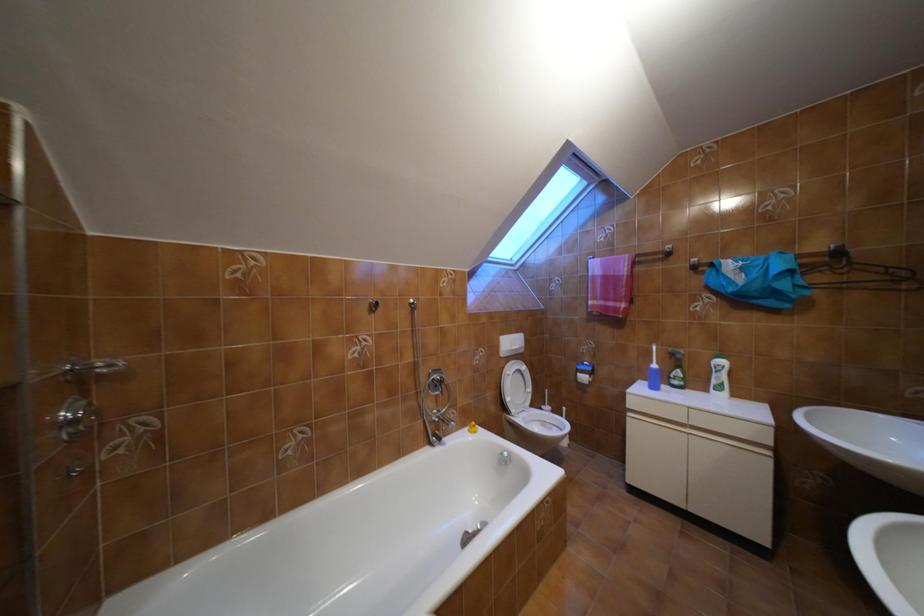
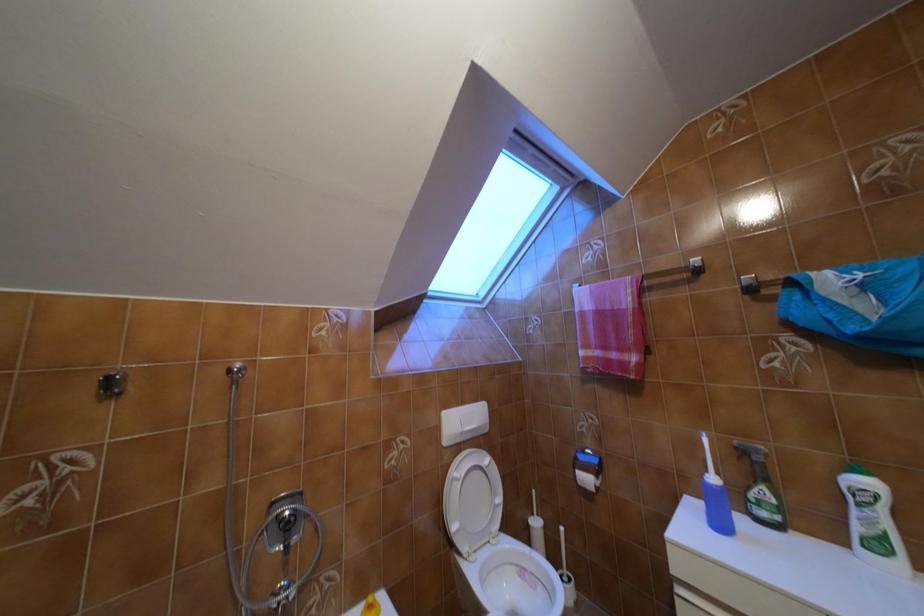
Question: The first image is from the beginning of the video and the second image is from the end. How did the camera likely rotate when shooting the video?

Choices:
 (A) Left
 (B) Right
 (C) Up
 (D) Down

Answer: (C)